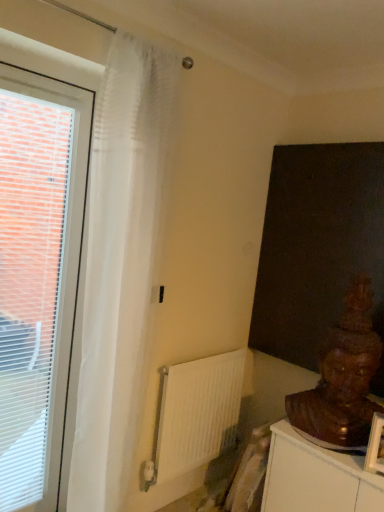
Question: Is white matte radiator at center positioned behind white plastic window at left?

Choices:
 (A) yes
 (B) no

Answer: (A)

Question: Can you confirm if white matte radiator at center is wider than white plastic window at left?

Choices:
 (A) yes
 (B) no

Answer: (B)

Question: Is white matte radiator at center oriented towards white plastic window at left?

Choices:
 (A) no
 (B) yes

Answer: (A)

Question: Is there a large distance between white matte radiator at center and white plastic window at left?

Choices:
 (A) no
 (B) yes

Answer: (A)

Question: Can you confirm if white matte radiator at center is positioned to the right of white plastic window at left?

Choices:
 (A) yes
 (B) no

Answer: (A)

Question: Is point (51, 261) closer or farther from the camera than point (299, 414)?

Choices:
 (A) closer
 (B) farther

Answer: (A)

Question: Looking at their shapes, would you say white plastic window at left is wider or thinner than brown wooden statue at lower right?

Choices:
 (A) thin
 (B) wide

Answer: (A)

Question: Is white plastic window at left spatially inside brown wooden statue at lower right, or outside of it?

Choices:
 (A) inside
 (B) outside

Answer: (B)

Question: In the image, is white plastic window at left on the left side or the right side of brown wooden statue at lower right?

Choices:
 (A) right
 (B) left

Answer: (B)

Question: Considering the positions of translucent white curtain at left and white matte radiator at center in the image, is translucent white curtain at left bigger or smaller than white matte radiator at center?

Choices:
 (A) small
 (B) big

Answer: (B)

Question: In terms of width, does translucent white curtain at left look wider or thinner when compared to white matte radiator at center?

Choices:
 (A) thin
 (B) wide

Answer: (B)

Question: Considering their positions, is translucent white curtain at left located in front of or behind white matte radiator at center?

Choices:
 (A) front
 (B) behind

Answer: (A)

Question: From the image's perspective, relative to white matte radiator at center, is translucent white curtain at left above or below?

Choices:
 (A) above
 (B) below

Answer: (A)

Question: From a real-world perspective, is translucent white curtain at left above or below white plastic window at left?

Choices:
 (A) below
 (B) above

Answer: (B)

Question: Which is correct: translucent white curtain at left is inside white plastic window at left, or outside of it?

Choices:
 (A) outside
 (B) inside

Answer: (A)